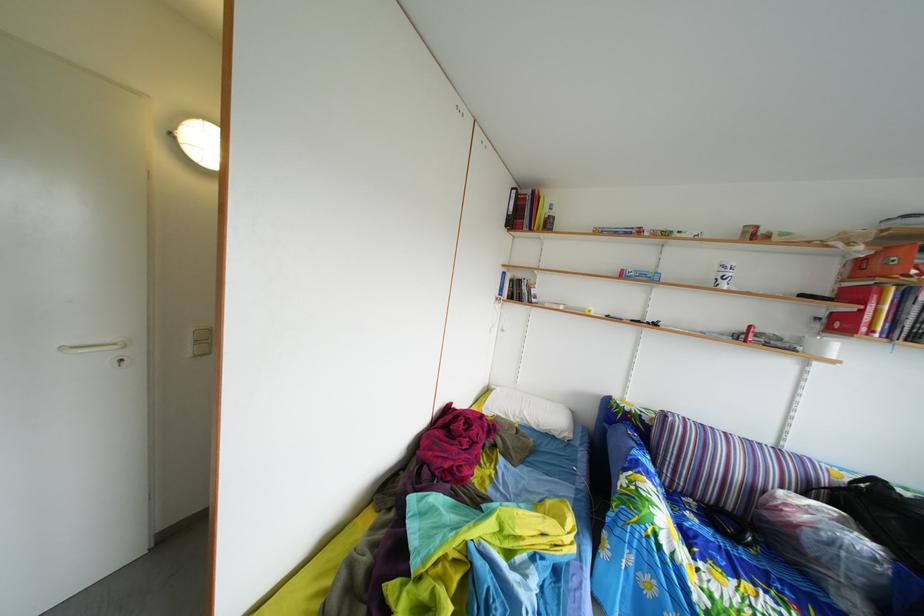
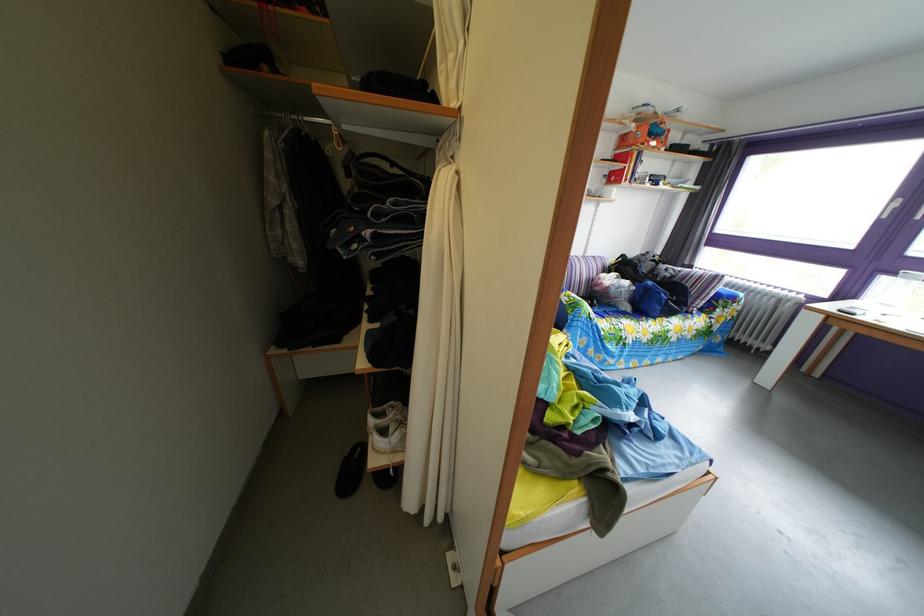
Find the pixel in the second image that matches the point at 834,323 in the first image.

(618, 180)